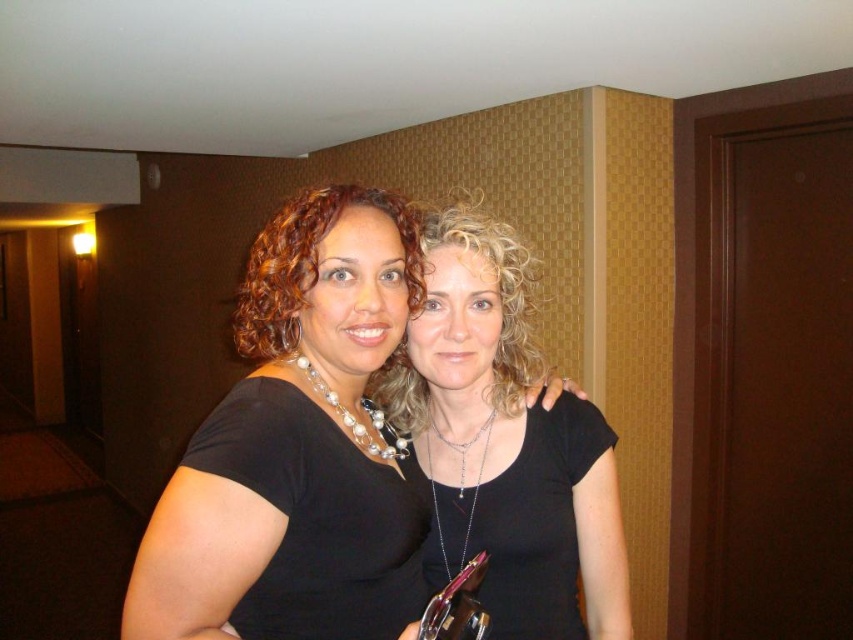
You are a photographer adjusting your camera settings to capture the scene. You notice the black matte shirt at center and the black matte necklace at center. Which object should you focus on first if you want to ensure both are in sharp focus, considering their positions?

The black matte shirt at center is positioned on the left side of the black matte necklace at center. Therefore, focusing on the black matte shirt at center first will help ensure both are in sharp focus since it is closer to the camera.

You are a photographer trying to capture a clear shot of the black matte necklace at center. However, the black matte shirt at center is blocking your view. Can you adjust your angle to see the necklace without moving the subjects?

The black matte shirt at center is in front of the black matte necklace at center, so adjusting your angle might allow you to see around the shirt to capture the necklace without moving the subjects.

You are a photographer trying to focus on the black matte shirt at center and the black matte necklace at center in the image. Which object should you zoom in on to capture more details without moving the camera?

The black matte shirt at center is larger in size than the black matte necklace at center, so you should zoom in on the black matte necklace at center to capture more details without moving the camera.